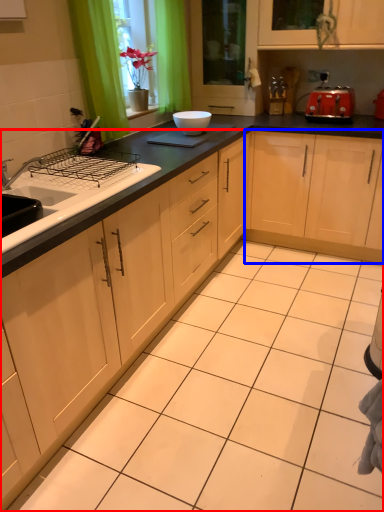
Question: Among these objects, which one is farthest to the camera, cabinetry (highlighted by a red box) or cabinetry (highlighted by a blue box)?

Choices:
 (A) cabinetry
 (B) cabinetry

Answer: (B)